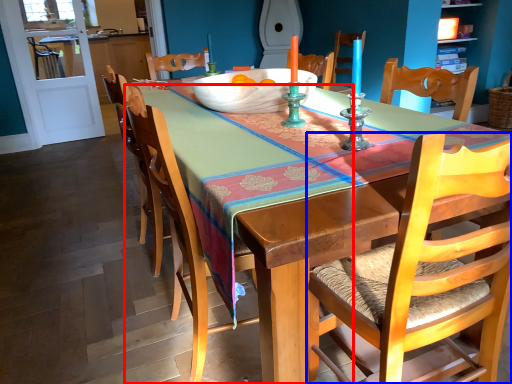
Question: Among these objects, which one is nearest to the camera, chair (highlighted by a red box) or chair (highlighted by a blue box)?

Choices:
 (A) chair
 (B) chair

Answer: (B)